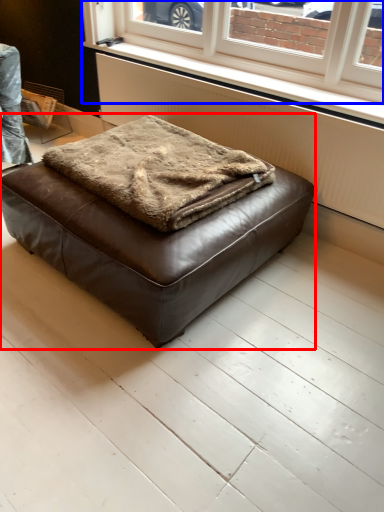
Question: Which object is closer to the camera taking this photo, furniture (highlighted by a red box) or window (highlighted by a blue box)?

Choices:
 (A) furniture
 (B) window

Answer: (A)